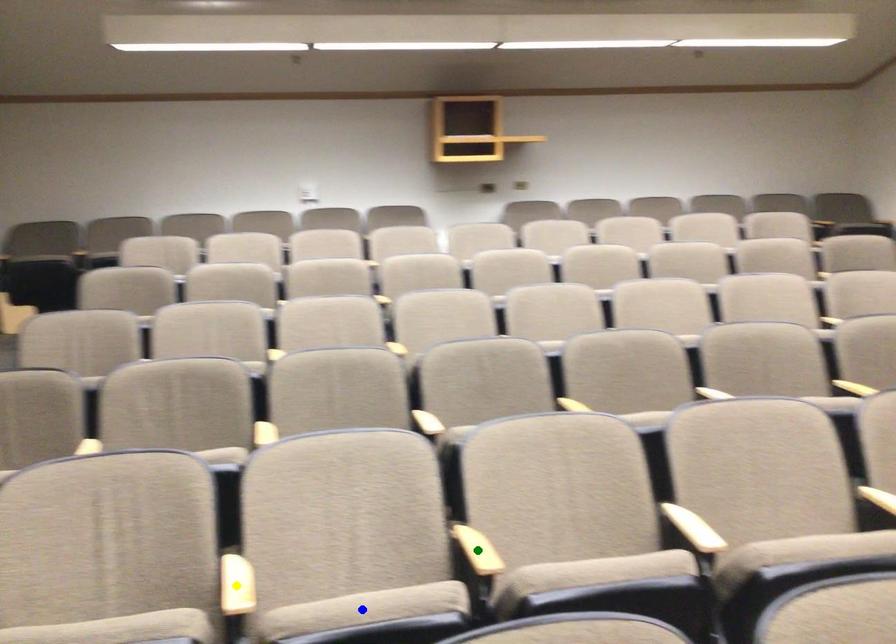
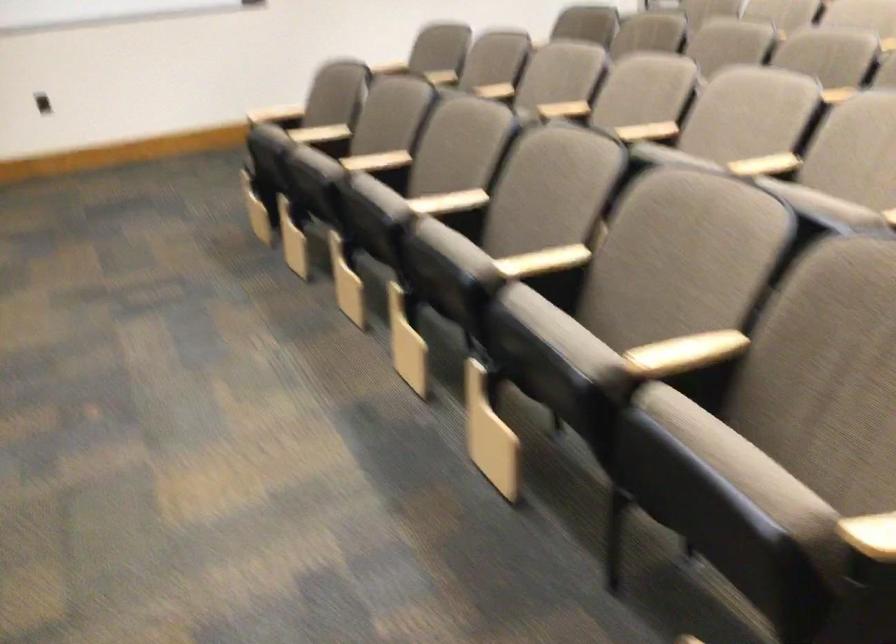
I am providing you with two images of the same scene from different viewpoints. Three points are marked in image1. Which point corresponds to a part or object that is occluded in image2?In image1, three points are marked. Which of them correspond to a part or object that is occluded in image2?Among the three points shown in image1, which one corresponds to a part or object that is no longer visible due to occlusion in image2?

yellow point, green point, blue point cannot be seen in image2.